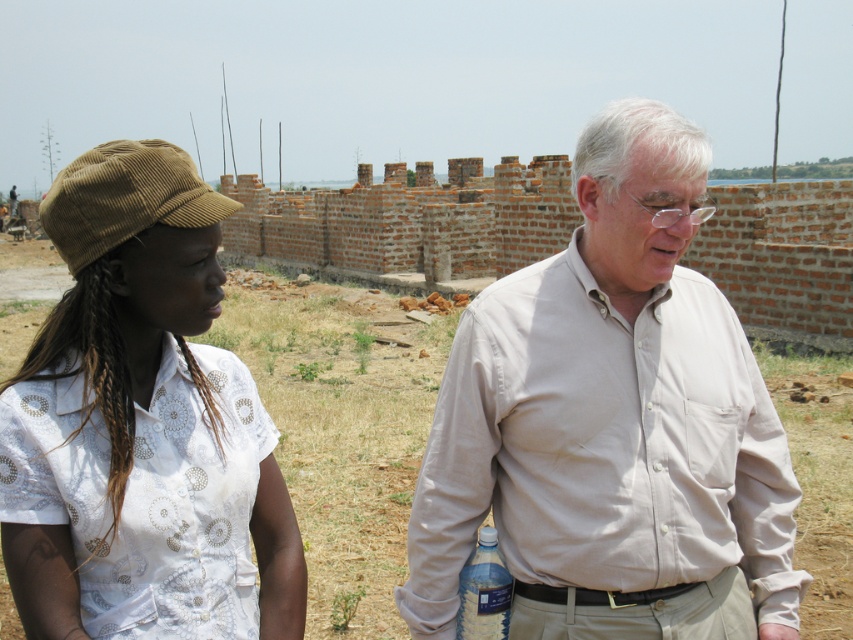
Question: Which point is closer to the camera taking this photo?

Choices:
 (A) (364, 528)
 (B) (643, 179)
 (C) (173, 234)
 (D) (506, 605)

Answer: (C)

Question: Is beige cotton shirt at center thinner than clear plastic bottle at lower center?

Choices:
 (A) no
 (B) yes

Answer: (A)

Question: Among these objects, which one is farthest from the camera?

Choices:
 (A) beige cotton shirt at center
 (B) clear plastic bottle at lower center
 (C) brown corduroy cap at left

Answer: (B)

Question: Is beige cotton shirt at center below clear plastic bottle at lower center?

Choices:
 (A) yes
 (B) no

Answer: (B)

Question: Which object is the farthest from the brown dry grass at center?

Choices:
 (A) beige cotton shirt at center
 (B) clear plastic bottle at lower center

Answer: (A)

Question: Does brown corduroy cap at left appear over brown dry grass at center?

Choices:
 (A) no
 (B) yes

Answer: (A)